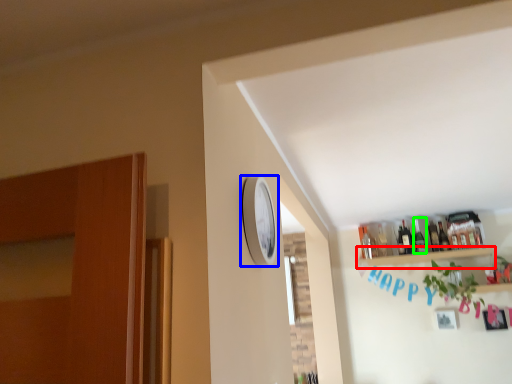
Question: Estimate the real-world distances between objects in this image. Which object is closer to shelf (highlighted by a red box), clock (highlighted by a blue box) or bottle (highlighted by a green box)?

Choices:
 (A) clock
 (B) bottle

Answer: (B)